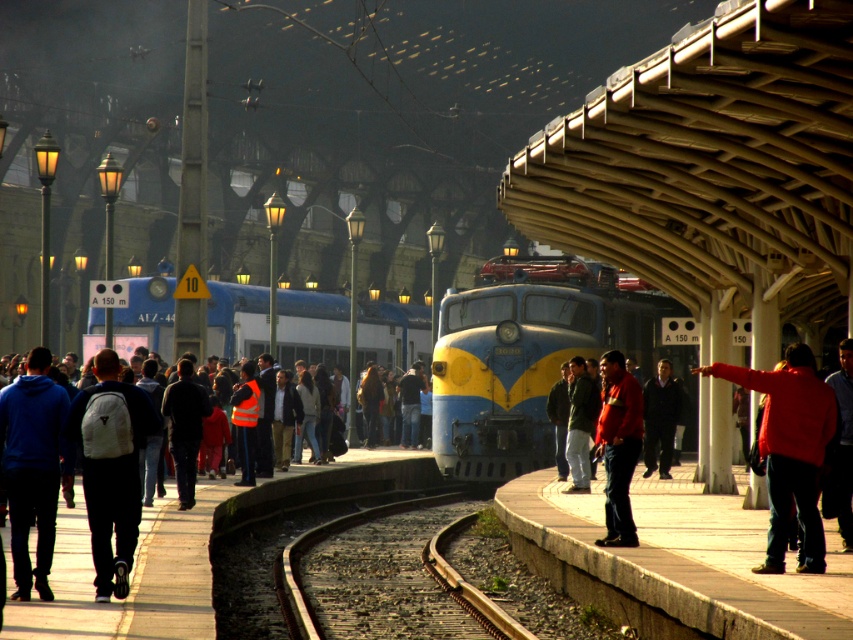
You are a pedestrian on the platform and see the orange reflective vest at left and the brown gravel train track at center. Which object appears bigger to you?

The orange reflective vest at left appears bigger than the brown gravel train track at center because it is larger in size.

You are standing on the train station platform and want to take a photo of both point [688,570] and point [438,592] in the image. Which point should you focus on first to ensure both are in sharp focus?

You should focus on point [688,570] first because it is closer to the viewer than point [438,592]. This ensures the closer point is in focus, and the farther point will also be sharp due to depth of field.